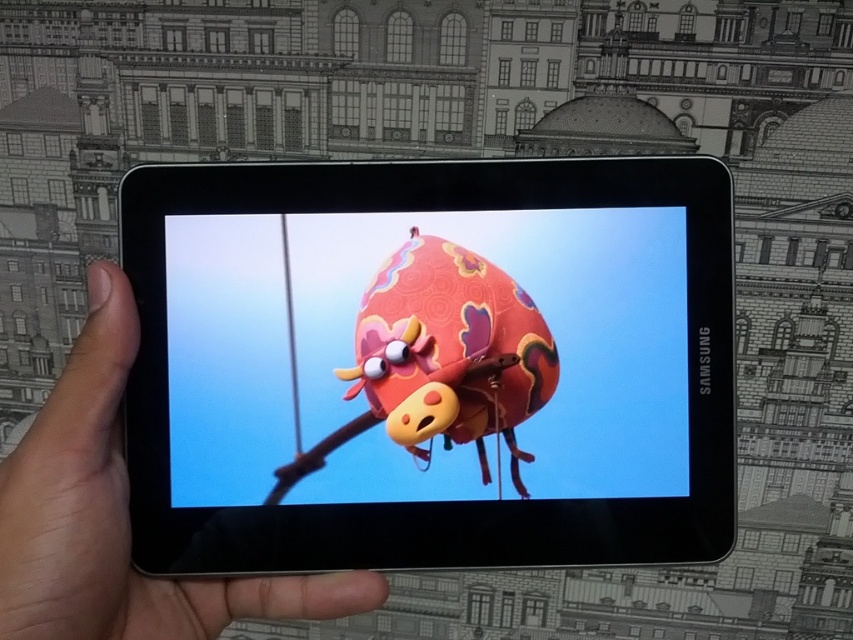
Who is shorter, black glossy tablet at center or matte black tablet at center?

With less height is matte black tablet at center.

Locate an element on the screen. Image resolution: width=853 pixels, height=640 pixels. black glossy tablet at center is located at coordinates (430, 364).

This screenshot has width=853, height=640. I want to click on black glossy tablet at center, so click(430, 364).